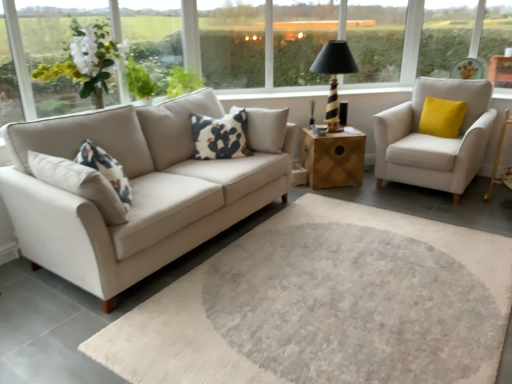
The image size is (512, 384). What do you see at coordinates (434, 137) in the screenshot?
I see `white fabric armchair at right` at bounding box center [434, 137].

Find the location of a particular element. This screenshot has height=384, width=512. wooden side table at center is located at coordinates (333, 158).

You are a GUI agent. You are given a task and a screenshot of the screen. Output one action in this format:
    pyautogui.click(x=<x>, y=<y>)
    Task: Click on the white matte flower at upper left
    Image resolution: width=512 pixels, height=384 pixels.
    Given the screenshot: What is the action you would take?
    pyautogui.click(x=86, y=61)

Measure the distance between point (219, 123) and camera.

Point (219, 123) is 11.15 feet away from camera.

This screenshot has height=384, width=512. I want to click on yellow velvet pillow at right, placed as the 1th pillow when sorted from right to left, so click(441, 117).

From the image's perspective, is black and white printed pillow at center, which appears as the 1th pillow when viewed from the front, beneath black striped wood table lamp at upper center?

Correct, black and white printed pillow at center, which appears as the 1th pillow when viewed from the front, appears lower than black striped wood table lamp at upper center in the image.

Would you say black and white printed pillow at center, which ranks as the 1th pillow in left-to-right order, contains black striped wood table lamp at upper center?

Actually, black striped wood table lamp at upper center is outside black and white printed pillow at center, which ranks as the 1th pillow in left-to-right order.

Does point (218, 119) lie behind point (346, 61)?

No, it is not.

Is black and white printed pillow at center, which appears as the 1th pillow when viewed from the front, facing towards black striped wood table lamp at upper center?

No, black and white printed pillow at center, which appears as the 1th pillow when viewed from the front, is not turned towards black striped wood table lamp at upper center.

Which of these two, black and white printed pillow at center, the 2th pillow when ordered from back to front, or yellow velvet pillow at right, the second pillow viewed from the front, is smaller?

With smaller size is yellow velvet pillow at right, the second pillow viewed from the front.

Considering the positions of point (226, 128) and point (439, 105), is point (226, 128) closer or farther from the camera than point (439, 105)?

Point (226, 128) appears to be closer to the viewer than point (439, 105).

From the image's perspective, is black and white printed pillow at center, which ranks as the 1th pillow in left-to-right order, located above or below yellow velvet pillow at right, the second pillow viewed from the front?

Based on their image positions, black and white printed pillow at center, which ranks as the 1th pillow in left-to-right order, is located beneath yellow velvet pillow at right, the second pillow viewed from the front.

Does black and white printed pillow at center, which appears as the 1th pillow when viewed from the front, turn towards yellow velvet pillow at right, the second pillow viewed from the front?

No, black and white printed pillow at center, which appears as the 1th pillow when viewed from the front, is not turned towards yellow velvet pillow at right, the second pillow viewed from the front.

Does white matte flower at upper left have a lesser width compared to white fabric armchair at right?

Yes, white matte flower at upper left is thinner than white fabric armchair at right.

How much distance is there between white matte flower at upper left and white fabric armchair at right?

white matte flower at upper left and white fabric armchair at right are 8.75 feet apart from each other.

Is white matte flower at upper left oriented towards white fabric armchair at right?

No, white matte flower at upper left is not turned towards white fabric armchair at right.

What are the coordinates of `chair located below the white matte flower at upper left (from the image's perspective)` in the screenshot? It's located at (434, 137).

In the scene shown: Between white fabric armchair at right and white matte flower at upper left, which one has smaller size?

With smaller size is white matte flower at upper left.

Is white fabric armchair at right beside white matte flower at upper left?

No.

In the scene shown: How distant is white fabric armchair at right from white matte flower at upper left?

A distance of 8.75 feet exists between white fabric armchair at right and white matte flower at upper left.

From the picture: Is white fabric armchair at right facing towards wooden side table at center?

No.

Would you consider white fabric armchair at right to be distant from wooden side table at center?

No.

Would you say white fabric armchair at right contains wooden side table at center?

That's incorrect, wooden side table at center is not inside white fabric armchair at right.

Considering the relative sizes of white fabric armchair at right and wooden side table at center in the image provided, is white fabric armchair at right smaller than wooden side table at center?

No.

From the image's perspective, which is below, black striped wood table lamp at upper center or white matte flower at upper left?

white matte flower at upper left.

Is black striped wood table lamp at upper center not near white matte flower at upper left?

black striped wood table lamp at upper center is positioned a significant distance from white matte flower at upper left.

Is white matte flower at upper left at the back of black striped wood table lamp at upper center?

That's not correct — black striped wood table lamp at upper center is not looking away from white matte flower at upper left.

Can you confirm if black striped wood table lamp at upper center is shorter than white matte flower at upper left?

No, black striped wood table lamp at upper center is not shorter than white matte flower at upper left.

Is wooden side table at center at the back of white matte flower at upper left?

No.

Consider the image. Is the surface of white matte flower at upper left in direct contact with wooden side table at center?

They are not placed beside each other.

The width and height of the screenshot is (512, 384). Identify the location of the 1st pillow located beneath the black striped wood table lamp at upper center (from a real-world perspective). (220, 136).

The height and width of the screenshot is (384, 512). I want to click on pillow on the left of yellow velvet pillow at right, placed as the 1th pillow when sorted from right to left, so click(x=220, y=136).

Estimate the real-world distances between objects in this image. Which object is closer to white fabric armchair at right, white matte flower at upper left or yellow velvet pillow at right, placed as the 1th pillow when sorted from right to left?

The object closer to white fabric armchair at right is yellow velvet pillow at right, placed as the 1th pillow when sorted from right to left.

Based on their spatial positions, is yellow velvet pillow at right, positioned as the 1th pillow in back-to-front order, or black striped wood table lamp at upper center closer to black and white printed pillow at center, the 2th pillow when ordered from back to front?

Based on the image, black striped wood table lamp at upper center appears to be nearer to black and white printed pillow at center, the 2th pillow when ordered from back to front.

Looking at this image, when comparing their distances from white fabric armchair at right, does wooden side table at center or black striped wood table lamp at upper center seem further?

black striped wood table lamp at upper center.

From the image, which object appears to be farther from white fabric armchair at right, black striped wood table lamp at upper center or yellow velvet pillow at right, placed as the 1th pillow when sorted from right to left?

Based on the image, black striped wood table lamp at upper center appears to be further to white fabric armchair at right.

Looking at the image, which one is located closer to black and white printed pillow at center, which ranks as the 1th pillow in left-to-right order, wooden side table at center or yellow velvet pillow at right, positioned as the 1th pillow in back-to-front order?

The object closer to black and white printed pillow at center, which ranks as the 1th pillow in left-to-right order, is wooden side table at center.

Considering their positions, is white matte flower at upper left positioned closer to white fabric armchair at right than black and white printed pillow at center, which appears as the 1th pillow when viewed from the front?

black and white printed pillow at center, which appears as the 1th pillow when viewed from the front.

Which object lies nearer to the anchor point white fabric armchair at right, wooden side table at center or white matte flower at upper left?

wooden side table at center is positioned closer to the anchor white fabric armchair at right.

Which object lies nearer to the anchor point white matte flower at upper left, black striped wood table lamp at upper center or black and white printed pillow at center, which appears as the 1th pillow when viewed from the front?

Among the two, black and white printed pillow at center, which appears as the 1th pillow when viewed from the front, is located nearer to white matte flower at upper left.

At what (x,y) coordinates should I click in order to perform the action: click on table between white matte flower at upper left and black striped wood table lamp at upper center. Please return your answer as a coordinate pair (x, y). The image size is (512, 384). Looking at the image, I should click on (333, 158).

You are a GUI agent. You are given a task and a screenshot of the screen. Output one action in this format:
    pyautogui.click(x=<x>, y=<y>)
    Task: Click on the table located between black and white printed pillow at center, which appears as the 1th pillow when viewed from the front, and black striped wood table lamp at upper center in the left-right direction
    The image size is (512, 384).
    Given the screenshot: What is the action you would take?
    pyautogui.click(x=333, y=158)

In order to click on chair between black and white printed pillow at center, the second pillow positioned from the right, and yellow velvet pillow at right, the second pillow viewed from the front, in the horizontal direction in this screenshot , I will do `click(434, 137)`.

Find the location of a particular element. The image size is (512, 384). pillow located between white matte flower at upper left and wooden side table at center in the left-right direction is located at coordinates (220, 136).